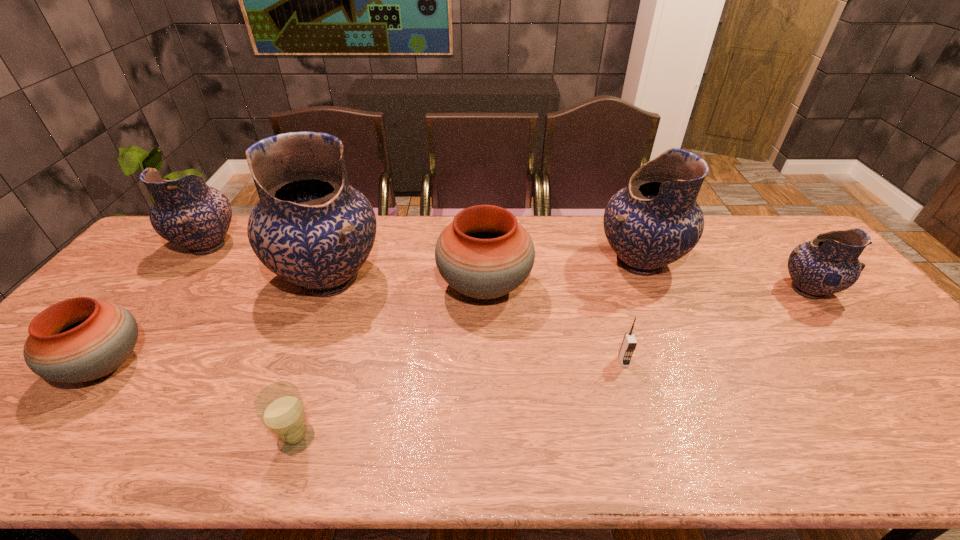
Locate an element on the screen. The height and width of the screenshot is (540, 960). the third pottery from left to right is located at coordinates click(x=311, y=228).

The width and height of the screenshot is (960, 540). What are the coordinates of `the tallest object` in the screenshot? It's located at (311, 228).

The width and height of the screenshot is (960, 540). Identify the location of the seventh shortest object. (654, 221).

Image resolution: width=960 pixels, height=540 pixels. I want to click on the second pottery from right to left, so click(654, 221).

Where is `the sixth shortest object`? the sixth shortest object is located at coordinates [187, 212].

The image size is (960, 540). Find the location of `the second smallest blue pottery`. the second smallest blue pottery is located at coordinates (187, 212).

Identify the location of the fifth object from left to right. Image resolution: width=960 pixels, height=540 pixels. pos(484,253).

The width and height of the screenshot is (960, 540). Identify the location of the right red pottery. (484, 253).

Identify the location of the rightmost object. This screenshot has height=540, width=960. (828, 264).

Where is `the rightmost blue pottery`? the rightmost blue pottery is located at coordinates click(828, 264).